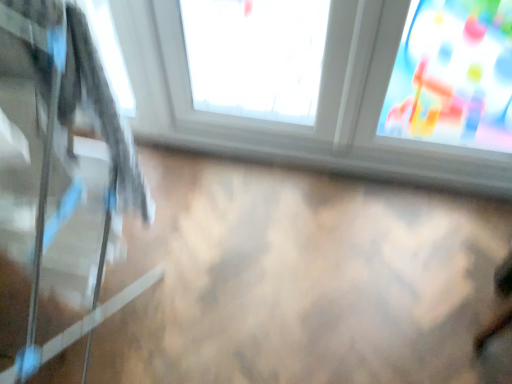
Image resolution: width=512 pixels, height=384 pixels. What do you see at coordinates (322, 82) in the screenshot?
I see `white plastic window frame at upper center` at bounding box center [322, 82].

At what (x,y) coordinates should I click in order to perform the action: click on white plastic window frame at upper center. Please return your answer as a coordinate pair (x, y). Looking at the image, I should click on click(x=322, y=82).

The height and width of the screenshot is (384, 512). Find the location of `white plastic window frame at upper center`. white plastic window frame at upper center is located at coordinates (322, 82).